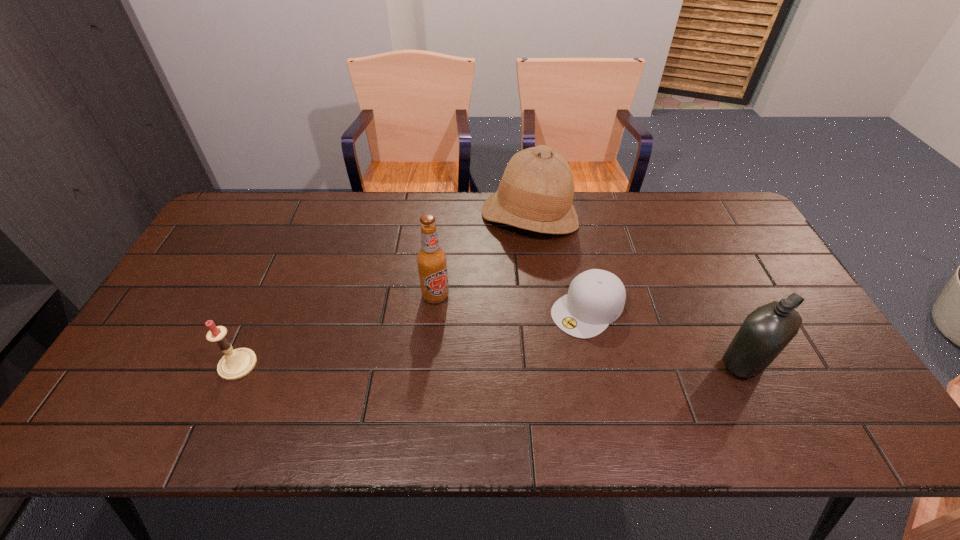
You are a GUI agent. You are given a task and a screenshot of the screen. Output one action in this format:
    pyautogui.click(x=<x>, y=<y>)
    Task: Click on the bottle positioned at the near edge
    
    Given the screenshot: What is the action you would take?
    pyautogui.click(x=766, y=331)

Where is `object that is at the right edge`? Image resolution: width=960 pixels, height=540 pixels. object that is at the right edge is located at coordinates (766, 331).

Where is `object that is at the near right corner`? The width and height of the screenshot is (960, 540). object that is at the near right corner is located at coordinates (766, 331).

At what (x,y) coordinates should I click in order to perform the action: click on free spot at the far edge of the desktop. Please return your answer as a coordinate pair (x, y). The width and height of the screenshot is (960, 540). Looking at the image, I should click on (463, 193).

In the image, there is a desktop. At what (x,y) coordinates should I click in order to perform the action: click on free region at the near edge. Please return your answer as a coordinate pair (x, y). Image resolution: width=960 pixels, height=540 pixels. Looking at the image, I should click on (405, 381).

The height and width of the screenshot is (540, 960). In the image, there is a desktop. Find the location of `vacant space at the right edge`. vacant space at the right edge is located at coordinates (803, 342).

I want to click on free space at the far left corner of the desktop, so click(x=241, y=226).

The height and width of the screenshot is (540, 960). I want to click on free spot between the farthest object and the third tallest object, so click(636, 289).

This screenshot has width=960, height=540. I want to click on free point between the second shortest object and the hat, so click(383, 291).

In order to click on free space between the cap and the candle in this screenshot , I will do `click(413, 337)`.